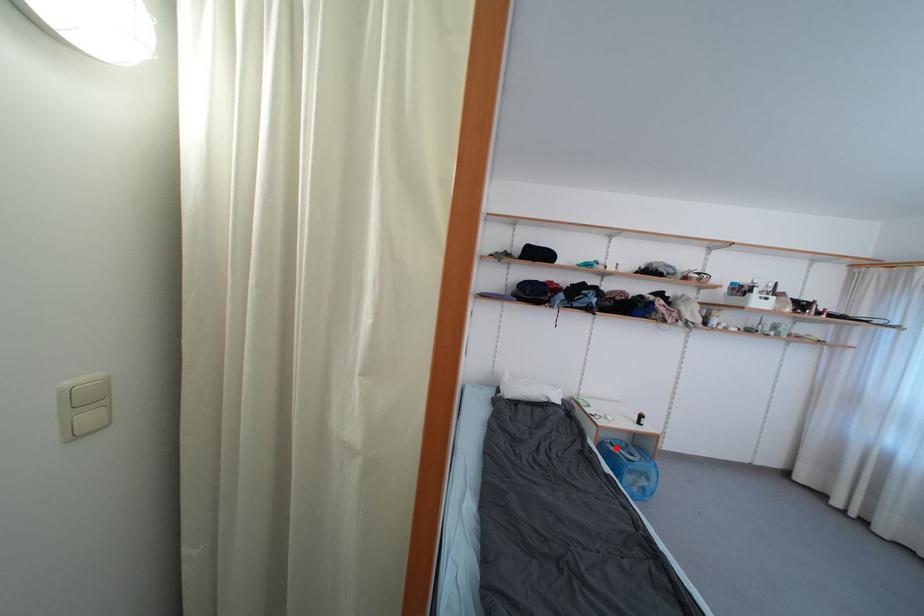
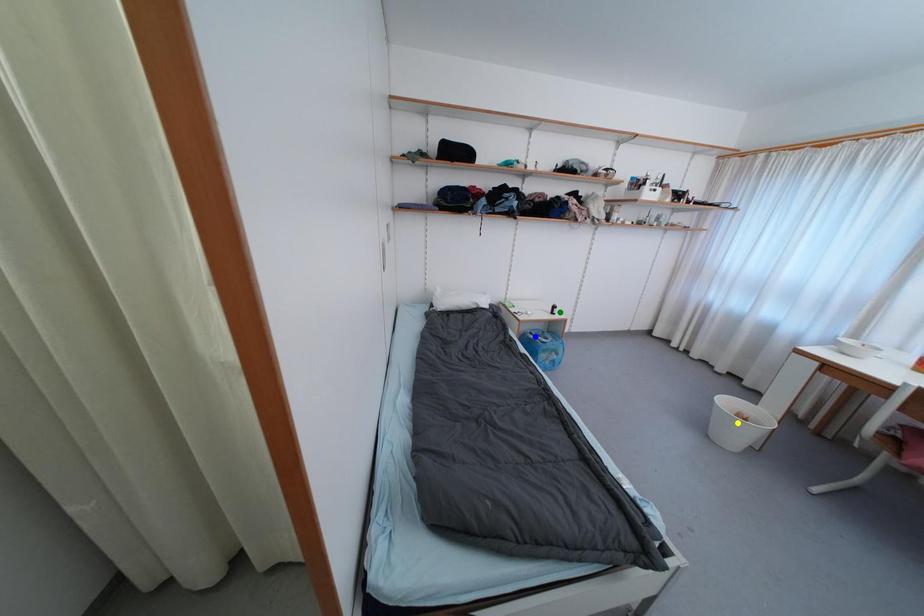
Question: I am providing you with two images of the same scene from different viewpoints. A red point is marked on the first image. You are given multiple points on the second image. Which mark in image 2 goes with the point in image 1?

Choices:
 (A) yellow point
 (B) blue point
 (C) green point

Answer: (B)